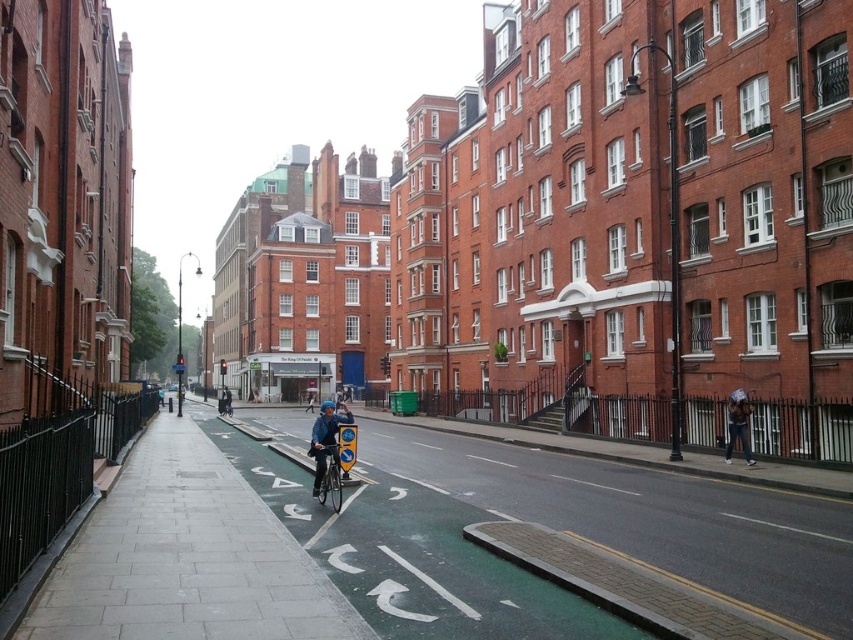
Question: Which of these objects is positioned farthest from the green rubber bike lane at center?

Choices:
 (A) blue matte bicycle helmet at center
 (B) denim jacket at lower right
 (C) gray concrete pavement at center

Answer: (B)

Question: Estimate the real-world distances between objects in this image. Which object is closer to the green rubber bike lane at center?

Choices:
 (A) blue matte bicycle helmet at center
 (B) denim jacket at lower right
 (C) silver metallic bicycle at center

Answer: (C)

Question: Which is nearer to the gray concrete pavement at center?

Choices:
 (A) denim jacket at lower right
 (B) silver metallic bicycle at center
 (C) blue matte bicycle helmet at center
 (D) green rubber bike lane at center

Answer: (D)

Question: Can you confirm if gray concrete pavement at center is thinner than denim jacket at lower right?

Choices:
 (A) no
 (B) yes

Answer: (A)

Question: Can you confirm if silver metallic bicycle at center is positioned to the left of denim jacket at lower right?

Choices:
 (A) no
 (B) yes

Answer: (B)

Question: Where is denim jacket at lower right located in relation to blue matte bicycle helmet at center in the image?

Choices:
 (A) left
 (B) right

Answer: (B)